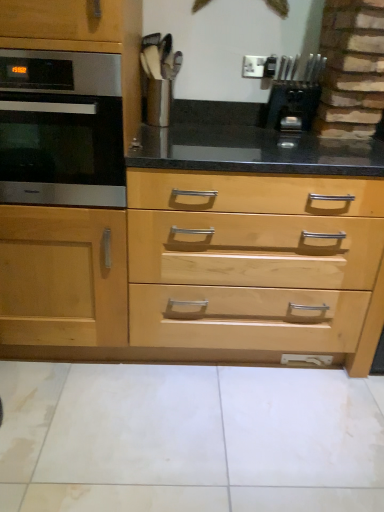
Question: Is black plastic knife block at upper right facing away from natural wood drawer at center?

Choices:
 (A) no
 (B) yes

Answer: (A)

Question: Considering the relative sizes of black plastic knife block at upper right and natural wood drawer at center in the image provided, is black plastic knife block at upper right bigger than natural wood drawer at center?

Choices:
 (A) no
 (B) yes

Answer: (A)

Question: Can you confirm if black plastic knife block at upper right is smaller than natural wood drawer at center?

Choices:
 (A) no
 (B) yes

Answer: (B)

Question: Does black plastic knife block at upper right have a greater width compared to natural wood drawer at center?

Choices:
 (A) no
 (B) yes

Answer: (A)

Question: Considering the relative sizes of black plastic knife block at upper right and natural wood drawer at center in the image provided, is black plastic knife block at upper right taller than natural wood drawer at center?

Choices:
 (A) yes
 (B) no

Answer: (B)

Question: Considering the positions of satin black oven at left and natural wood drawer at center in the image, is satin black oven at left wider or thinner than natural wood drawer at center?

Choices:
 (A) wide
 (B) thin

Answer: (B)

Question: From their relative heights in the image, would you say satin black oven at left is taller or shorter than natural wood drawer at center?

Choices:
 (A) tall
 (B) short

Answer: (B)

Question: Is satin black oven at left to the left or to the right of natural wood drawer at center in the image?

Choices:
 (A) right
 (B) left

Answer: (B)

Question: Is point (1, 155) positioned closer to the camera than point (372, 283)?

Choices:
 (A) farther
 (B) closer

Answer: (B)

Question: Is satin black oven at left wider or thinner than black plastic knife block at upper right?

Choices:
 (A) thin
 (B) wide

Answer: (B)

Question: From the image's perspective, relative to black plastic knife block at upper right, is satin black oven at left above or below?

Choices:
 (A) below
 (B) above

Answer: (A)

Question: Considering the positions of satin black oven at left and black plastic knife block at upper right in the image, is satin black oven at left bigger or smaller than black plastic knife block at upper right?

Choices:
 (A) small
 (B) big

Answer: (B)

Question: From a real-world perspective, is satin black oven at left positioned above or below black plastic knife block at upper right?

Choices:
 (A) below
 (B) above

Answer: (A)

Question: Which is correct: black plastic knife block at upper right is inside satin black oven at left, or outside of it?

Choices:
 (A) inside
 (B) outside

Answer: (B)

Question: In the image, is black plastic knife block at upper right on the left side or the right side of satin black oven at left?

Choices:
 (A) right
 (B) left

Answer: (A)